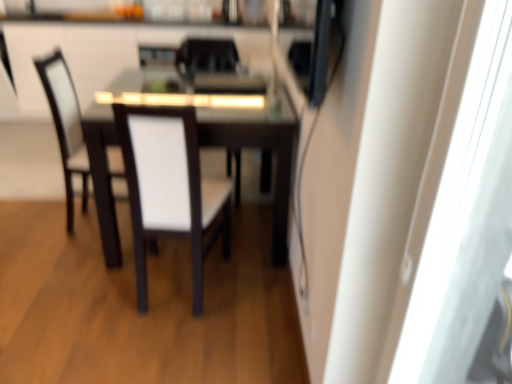
Question: Is dark wood table at center thinner than white fabric chair at center, the fourth chair from the back?

Choices:
 (A) no
 (B) yes

Answer: (A)

Question: Is dark wood table at center smaller than white fabric chair at center, which is the 1th chair from front to back?

Choices:
 (A) yes
 (B) no

Answer: (B)

Question: Is dark wood table at center far from white fabric chair at center, the fourth chair from the back?

Choices:
 (A) yes
 (B) no

Answer: (B)

Question: Is dark wood table at center positioned in front of white fabric chair at center, which is the 1th chair from front to back?

Choices:
 (A) no
 (B) yes

Answer: (A)

Question: Does dark wood table at center have a greater width compared to white fabric chair at center, the fourth chair from the back?

Choices:
 (A) no
 (B) yes

Answer: (B)

Question: Can you see dark wood table at center touching white fabric chair at center, which is the 1th chair from front to back?

Choices:
 (A) no
 (B) yes

Answer: (A)

Question: From a real-world perspective, is dark wood table at center on top of white fabric chair at center, acting as the fourth chair starting from the front?

Choices:
 (A) yes
 (B) no

Answer: (B)

Question: Is dark wood table at center bigger than white fabric chair at center, acting as the fourth chair starting from the front?

Choices:
 (A) no
 (B) yes

Answer: (B)

Question: Does dark wood table at center come behind white fabric chair at center, the first chair from the back?

Choices:
 (A) yes
 (B) no

Answer: (B)

Question: Considering the relative positions of dark wood table at center and white fabric chair at center, the first chair from the back, in the image provided, is dark wood table at center to the right of white fabric chair at center, the first chair from the back, from the viewer's perspective?

Choices:
 (A) yes
 (B) no

Answer: (B)

Question: Is dark wood table at center turned away from white fabric chair at center, acting as the fourth chair starting from the front?

Choices:
 (A) yes
 (B) no

Answer: (B)

Question: Is dark wood table at center positioned in front of white fabric chair at center, the first chair from the back?

Choices:
 (A) no
 (B) yes

Answer: (B)

Question: Considering the relative sizes of white fabric chair at center, the 2th chair when ordered from front to back, and white fabric chair at center, which is the 1th chair from front to back, in the image provided, is white fabric chair at center, the 2th chair when ordered from front to back, smaller than white fabric chair at center, which is the 1th chair from front to back,?

Choices:
 (A) yes
 (B) no

Answer: (A)